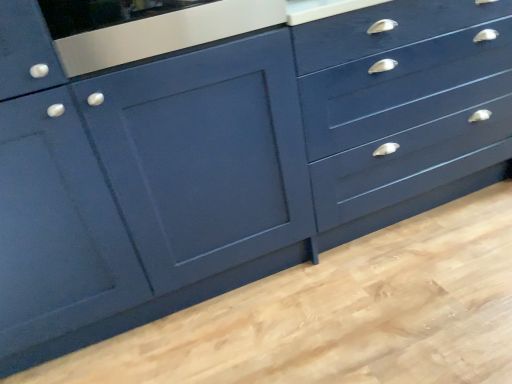
Describe the element at coordinates (204, 156) in the screenshot. The width and height of the screenshot is (512, 384). I see `matte blue cabinet at center` at that location.

I want to click on matte blue cabinet at center, so [204, 156].

Find the location of a particular element. This screenshot has width=512, height=384. matte blue cabinet at center is located at coordinates (204, 156).